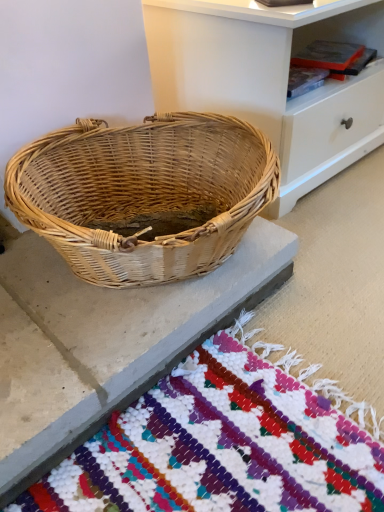
In order to face multicolored woven mat at lower center, should I rotate leftwards or rightwards?

You should look left and rotate roughly 9.959 degrees.

What do you see at coordinates (221, 446) in the screenshot?
I see `multicolored woven mat at lower center` at bounding box center [221, 446].

Image resolution: width=384 pixels, height=512 pixels. Identify the location of multicolored woven mat at lower center. (221, 446).

This screenshot has width=384, height=512. What are the coordinates of `multicolored woven mat at lower center` in the screenshot? It's located at (221, 446).